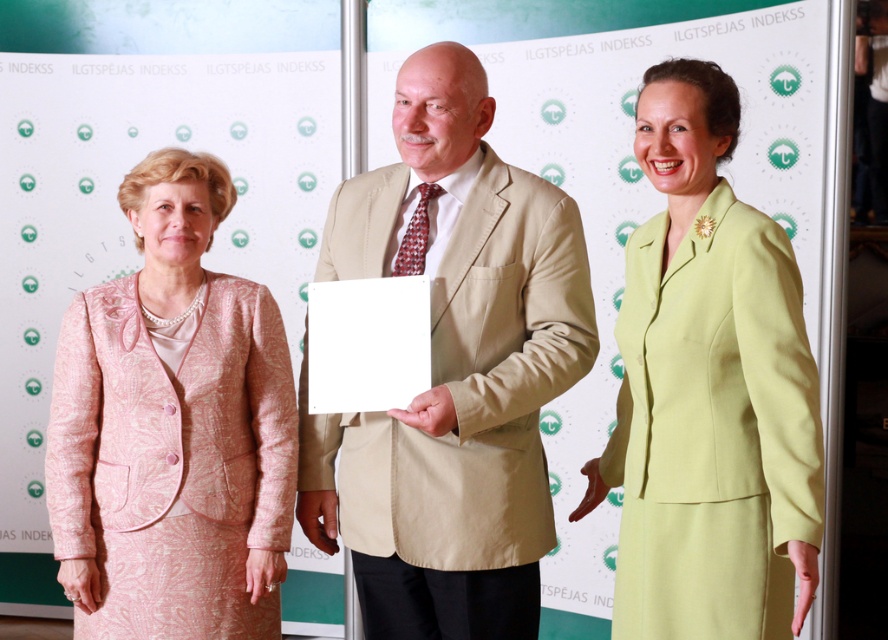
From the picture: Who is lower down, lime green fabric suit at right or pink textured suit at left?

pink textured suit at left is below.

Between lime green fabric suit at right and pink textured suit at left, which one is positioned higher?

lime green fabric suit at right

Locate an element on the screen. The width and height of the screenshot is (888, 640). lime green fabric suit at right is located at coordinates (710, 392).

At what (x,y) coordinates should I click in order to perform the action: click on lime green fabric suit at right. Please return your answer as a coordinate pair (x, y). Looking at the image, I should click on (710, 392).

Is point (448, 378) behind point (736, 209)?

That is True.

Is point (341, 464) positioned behind point (664, 394)?

Yes, it is behind point (664, 394).

You are a GUI agent. You are given a task and a screenshot of the screen. Output one action in this format:
    pyautogui.click(x=<x>, y=<y>)
    Task: Click on the beige fabric suit at center
    The height and width of the screenshot is (640, 888).
    Given the screenshot: What is the action you would take?
    pyautogui.click(x=452, y=371)

Is beige fabric suit at center thinner than pink textured suit at left?

No.

Is point (457, 586) less distant than point (274, 358)?

Yes, point (457, 586) is in front of point (274, 358).

This screenshot has height=640, width=888. Identify the location of beige fabric suit at center. (452, 371).

I want to click on beige fabric suit at center, so click(x=452, y=371).